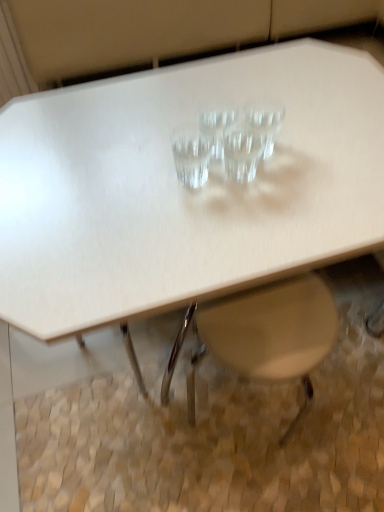
This screenshot has height=512, width=384. Find the location of `free space to the right of transparent glass martini at center, which is the 2th martini glass from right to left`. free space to the right of transparent glass martini at center, which is the 2th martini glass from right to left is located at coordinates (323, 164).